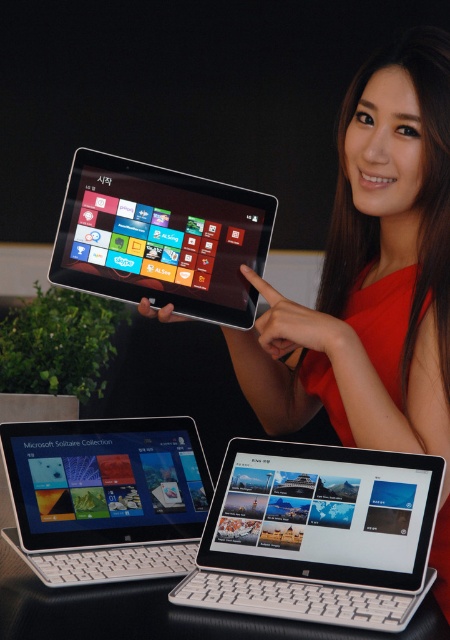
Is white plastic tablet at center wider than matte black laptop at center?

Yes, white plastic tablet at center is wider than matte black laptop at center.

Between white plastic tablet at center and matte black laptop at center, which one has less height?

Standing shorter between the two is white plastic tablet at center.

Is point (212, 512) in front of point (86, 518)?

Yes, point (212, 512) is closer to viewer.

Locate an element on the screen. The width and height of the screenshot is (450, 640). white plastic tablet at center is located at coordinates (318, 534).

Is matte black laptop at center bigger than matte black tablet at center?

Yes.

Does matte black laptop at center have a greater height compared to matte black tablet at center?

No, matte black laptop at center is not taller than matte black tablet at center.

The width and height of the screenshot is (450, 640). What are the coordinates of `matte black laptop at center` in the screenshot? It's located at (106, 497).

The height and width of the screenshot is (640, 450). What are the coordinates of `matte black laptop at center` in the screenshot? It's located at (106, 497).

Based on the photo, is white plastic tablet at center bigger than matte black tablet at center?

Yes.

Identify the location of white plastic tablet at center. Image resolution: width=450 pixels, height=640 pixels. (318, 534).

I want to click on white plastic tablet at center, so click(318, 534).